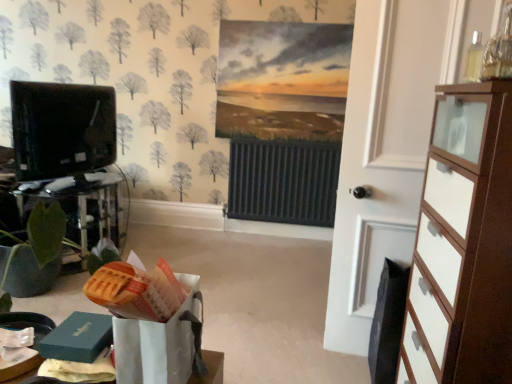
Question: Is white wood door at right taller or shorter than black glossy tv at left?

Choices:
 (A) short
 (B) tall

Answer: (B)

Question: From the image's perspective, is white wood door at right above or below black glossy tv at left?

Choices:
 (A) below
 (B) above

Answer: (A)

Question: Estimate the real-world distances between objects in this image. Which object is closer to the black glossy tv at left?

Choices:
 (A) white glossy chest of drawers at right
 (B) white wood door at right

Answer: (B)

Question: Considering the real-world distances, which object is closest to the black glossy tv at left?

Choices:
 (A) white glossy chest of drawers at right
 (B) white wood door at right

Answer: (B)